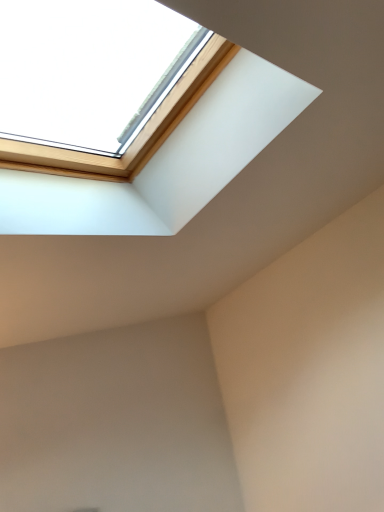
The width and height of the screenshot is (384, 512). What are the coordinates of `wooden frame at upper left` in the screenshot? It's located at (90, 71).

The image size is (384, 512). Describe the element at coordinates (90, 71) in the screenshot. I see `wooden frame at upper left` at that location.

Image resolution: width=384 pixels, height=512 pixels. In order to click on wooden frame at upper left in this screenshot , I will do `click(90, 71)`.